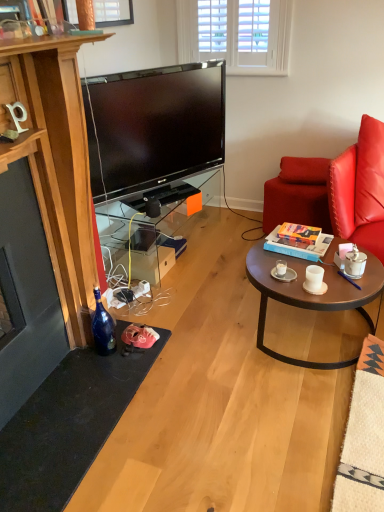
The height and width of the screenshot is (512, 384). Find the location of `vacant region to the right of white matte coffee cup at center right, which ranks as the 2th coffee cup in left-to-right order`. vacant region to the right of white matte coffee cup at center right, which ranks as the 2th coffee cup in left-to-right order is located at coordinates (349, 281).